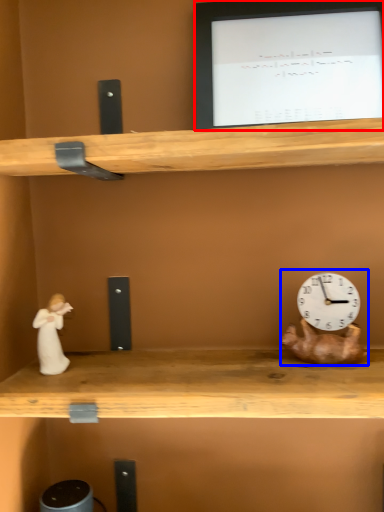
Question: Which object is further to the camera taking this photo, computer monitor (highlighted by a red box) or toy (highlighted by a blue box)?

Choices:
 (A) computer monitor
 (B) toy

Answer: (A)